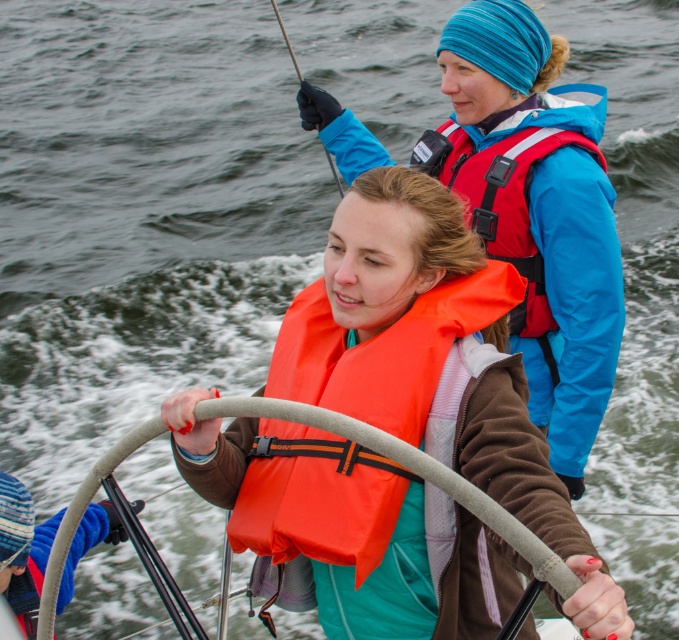
You are a sailor trying to store your gear. You have an orange matte life jacket at center and a blue fleece glove at center. Which item requires more space to store?

The orange matte life jacket at center requires more space to store because it might be wider than the blue fleece glove at center.

You are on a boat and need to reach an object located at point A and another at point B. Point A is at coordinates point (496, 198) and point B is at point (41, 528). Which point is closer to you?

Point (496, 198) is further to the viewer than point (41, 528), so point B at (41, 528) is closer to you.

You are a sailor who needs to reach the orange matte life jacket at center from your current position. The boat is 2 meters long. Can you reach the life jacket without moving your feet?

The orange matte life jacket at center is 1.97 meters away from you, so yes, you can reach it without moving your feet since the distance is slightly less than the boat length of 2 meters.